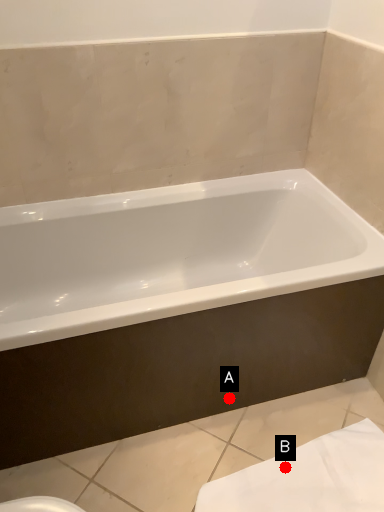
Question: Two points are circled on the image, labeled by A and B beside each circle. Among these points, which one is farthest from the camera?

Choices:
 (A) A is further
 (B) B is further

Answer: (A)